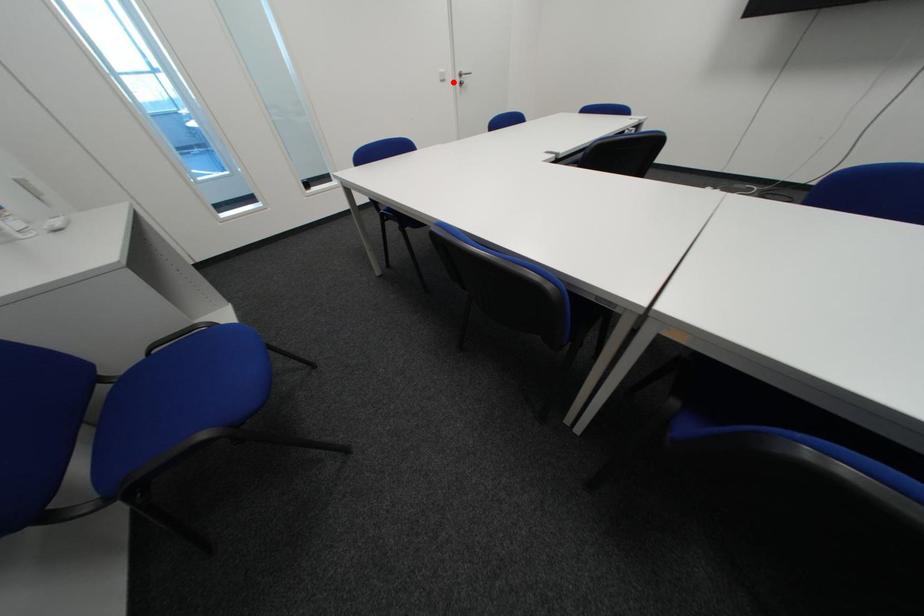
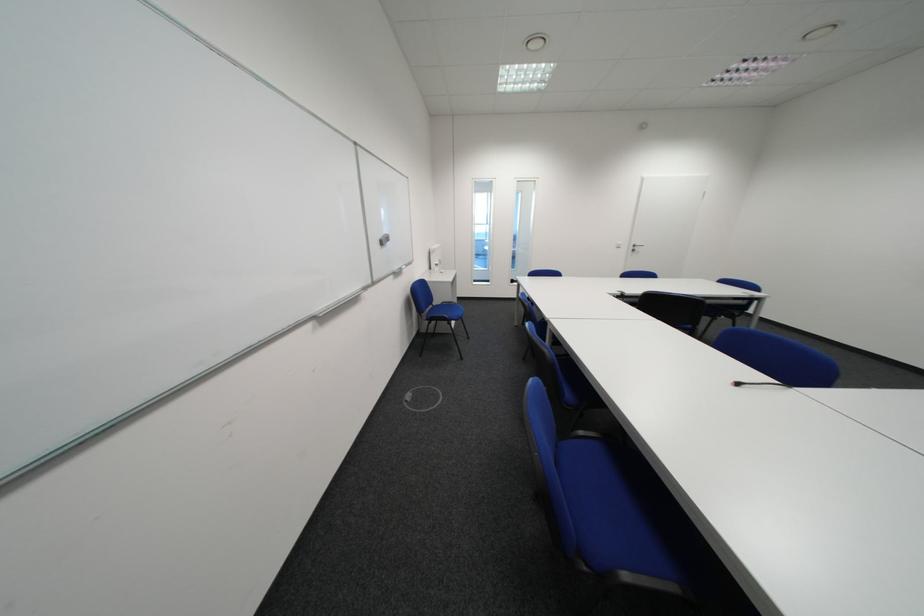
Question: I am providing you with two images of the same scene from different viewpoints. Image1 has a red point marked. In image2, the corresponding 3D location appears at what relative position? Reply with the corresponding letter.

Choices:
 (A) Closer
 (B) Farther

Answer: (B)